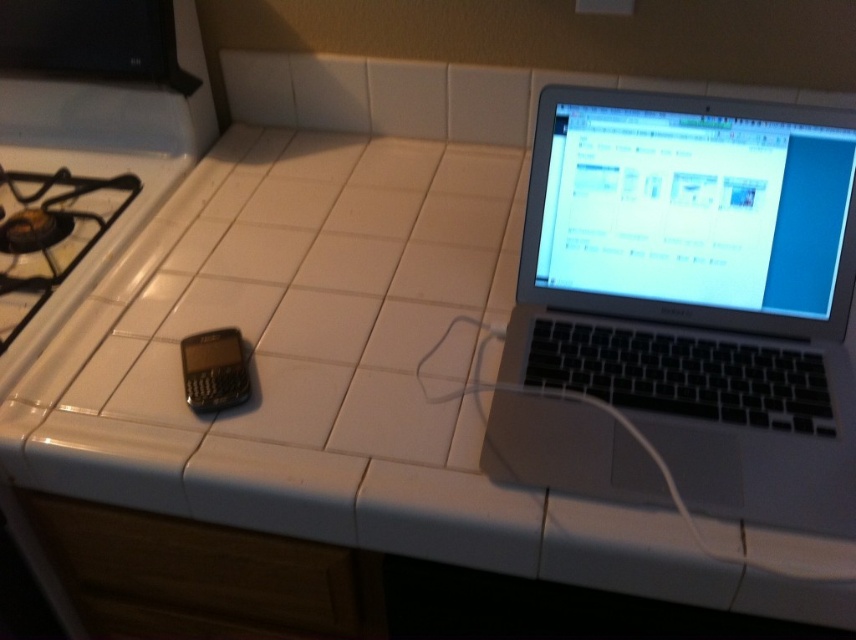
Question: Can you confirm if silver/black keyboard at right is thinner than black plastic phone at lower left?

Choices:
 (A) yes
 (B) no

Answer: (B)

Question: Considering the relative positions of silver/black keyboard at right and black plastic phone at lower left in the image provided, where is silver/black keyboard at right located with respect to black plastic phone at lower left?

Choices:
 (A) below
 (B) above

Answer: (B)

Question: Is silver/black keyboard at right to the right of black plastic phone at lower left from the viewer's perspective?

Choices:
 (A) no
 (B) yes

Answer: (B)

Question: Among these points, which one is farthest from the camera?

Choices:
 (A) (211, 349)
 (B) (782, 272)

Answer: (A)